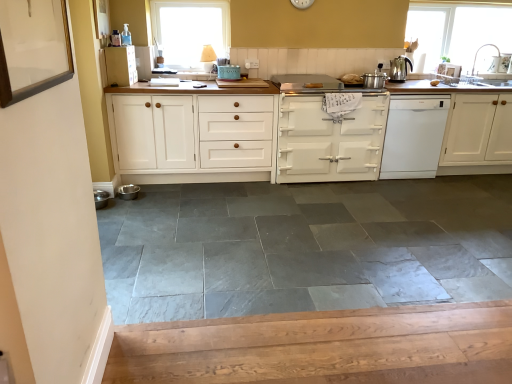
Question: From the image's perspective, is metallic silver sink at right, which is the 5th appliance in bottom-to-top order, below white glossy dishwasher at right?

Choices:
 (A) no
 (B) yes

Answer: (A)

Question: Is metallic silver sink at right, arranged as the 5th appliance when viewed from the left, taller than white glossy dishwasher at right?

Choices:
 (A) no
 (B) yes

Answer: (A)

Question: From a real-world perspective, is metallic silver sink at right, arranged as the 5th appliance when viewed from the left, on white glossy dishwasher at right?

Choices:
 (A) no
 (B) yes

Answer: (B)

Question: Is metallic silver sink at right, the 1th appliance from the right, not close to white glossy dishwasher at right?

Choices:
 (A) yes
 (B) no

Answer: (A)

Question: Is metallic silver sink at right, the 1th appliance from the right, wider than white glossy dishwasher at right?

Choices:
 (A) no
 (B) yes

Answer: (A)

Question: From the image's perspective, is white wood cabinet at upper center, the 1th cabinetry from the left, above or below white painted wood cabinet at center, the second cabinetry viewed from the left?

Choices:
 (A) below
 (B) above

Answer: (B)

Question: Considering the relative positions of white wood cabinet at upper center, the 4th cabinetry when ordered from right to left, and white painted wood cabinet at center, which is counted as the third cabinetry, starting from the right, in the image provided, is white wood cabinet at upper center, the 4th cabinetry when ordered from right to left, to the left or to the right of white painted wood cabinet at center, which is counted as the third cabinetry, starting from the right,?

Choices:
 (A) right
 (B) left

Answer: (B)

Question: Is white wood cabinet at upper center, the 1th cabinetry from the left, in front of or behind white painted wood cabinet at center, which is counted as the third cabinetry, starting from the right, in the image?

Choices:
 (A) behind
 (B) front

Answer: (A)

Question: From a real-world perspective, is white wood cabinet at upper center, the 4th cabinetry when ordered from right to left, physically located above or below white painted wood cabinet at center, which is counted as the third cabinetry, starting from the right?

Choices:
 (A) above
 (B) below

Answer: (A)

Question: From the image's perspective, is matte green enamel stove at center, the third appliance viewed from the top, located above or below metallic stainless steel bowl at lower left, placed as the first appliance when sorted from front to back?

Choices:
 (A) above
 (B) below

Answer: (A)

Question: Looking at the image, does matte green enamel stove at center, placed as the fourth appliance when sorted from right to left, seem bigger or smaller compared to metallic stainless steel bowl at lower left, which is counted as the fifth appliance, starting from the top?

Choices:
 (A) small
 (B) big

Answer: (B)

Question: From a real-world perspective, is matte green enamel stove at center, which ranks as the 3th appliance in front-to-back order, physically located above or below metallic stainless steel bowl at lower left, which is the 1th appliance in left-to-right order?

Choices:
 (A) below
 (B) above

Answer: (B)

Question: Considering the positions of matte green enamel stove at center, the third appliance viewed from the back, and metallic stainless steel bowl at lower left, which appears as the first appliance when ordered from the bottom, in the image, is matte green enamel stove at center, the third appliance viewed from the back, taller or shorter than metallic stainless steel bowl at lower left, which appears as the first appliance when ordered from the bottom,?

Choices:
 (A) short
 (B) tall

Answer: (B)

Question: Based on their positions, is gray slate tile at center located to the left or right of polished stainless steel kettle at upper right?

Choices:
 (A) right
 (B) left

Answer: (B)

Question: From a real-world perspective, is gray slate tile at center above or below polished stainless steel kettle at upper right?

Choices:
 (A) below
 (B) above

Answer: (A)